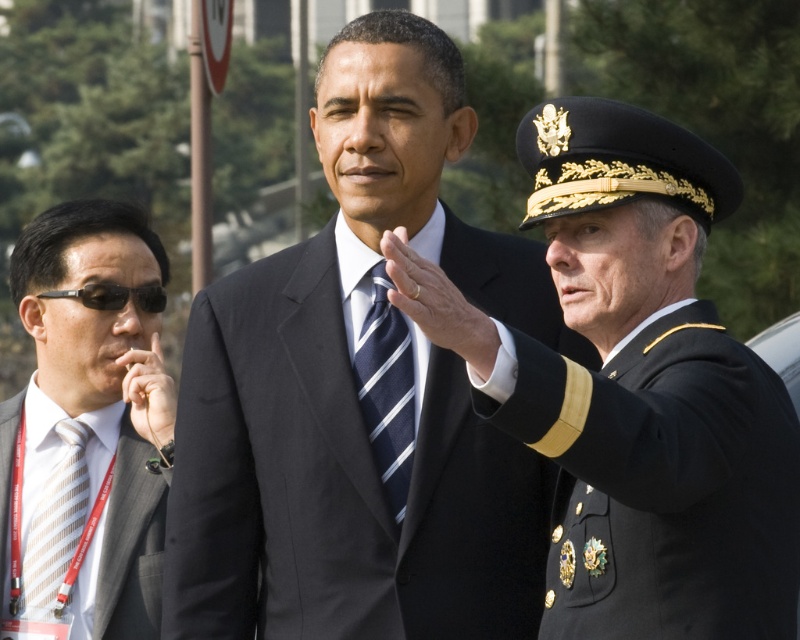
Is black matte suit at center thinner than white striped tie at left?

No.

In order to click on black matte suit at center in this screenshot , I will do `click(649, 394)`.

Based on the photo, can you confirm if black matte suit at center is shorter than black military uniform at right?

Incorrect, black matte suit at center's height does not fall short of black military uniform at right's.

Can you confirm if black matte suit at center is positioned above black military uniform at right?

Yes, black matte suit at center is above black military uniform at right.

Based on the photo, who is more forward, [530,385] or [652,420]?

Point [530,385] is in front.

You are a GUI agent. You are given a task and a screenshot of the screen. Output one action in this format:
    pyautogui.click(x=<x>, y=<y>)
    Task: Click on the black matte suit at center
    This screenshot has height=640, width=800.
    Given the screenshot: What is the action you would take?
    pyautogui.click(x=649, y=394)

Between black matte suit at center and blue striped tie at center, which one is positioned lower?

Positioned lower is blue striped tie at center.

Measure the distance between black matte suit at center and blue striped tie at center.

black matte suit at center is 7.33 feet away from blue striped tie at center.

Does point (730, 528) come farther from viewer compared to point (366, 360)?

No, it is not.

Locate an element on the screen. The image size is (800, 640). black matte suit at center is located at coordinates (649, 394).